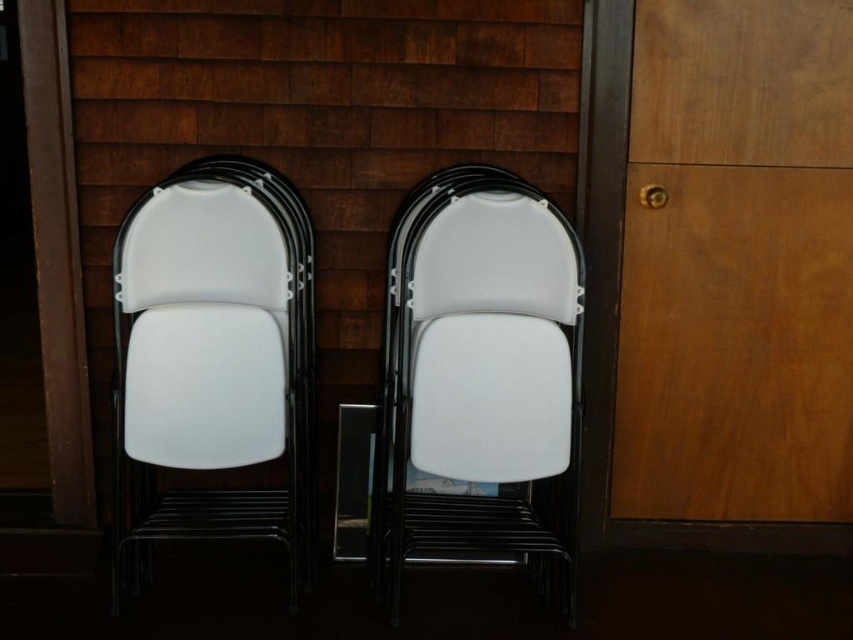
Can you confirm if white plastic chair at center is positioned above white plastic chair at left?

No.

Is white plastic chair at center closer to camera compared to white plastic chair at left?

No, white plastic chair at center is further to the viewer.

Describe the element at coordinates (479, 376) in the screenshot. I see `white plastic chair at center` at that location.

Locate an element on the screen. The width and height of the screenshot is (853, 640). white plastic chair at center is located at coordinates (479, 376).